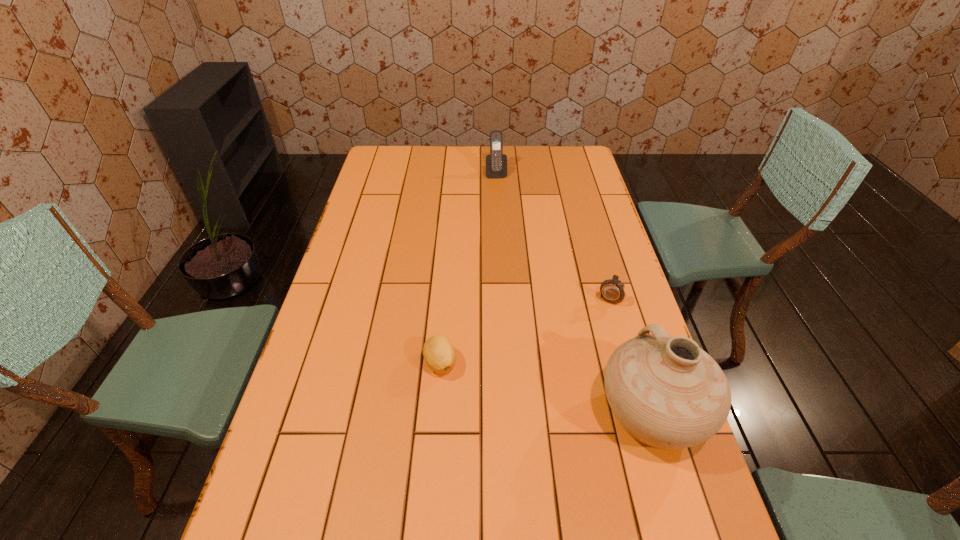
You are a GUI agent. You are given a task and a screenshot of the screen. Output one action in this format:
    pyautogui.click(x=<x>, y=<y>)
    Task: Click on the leftmost object
    The image size is (960, 540).
    Given the screenshot: What is the action you would take?
    pyautogui.click(x=439, y=353)

Where is `the shortest object`? the shortest object is located at coordinates (439, 353).

Find the location of `pottery`. pottery is located at coordinates (667, 392).

You are a GUI agent. You are given a task and a screenshot of the screen. Output one action in this format:
    pyautogui.click(x=<x>, y=<y>)
    Task: Click on the second shortest object
    Image resolution: width=960 pixels, height=540 pixels.
    Given the screenshot: What is the action you would take?
    pyautogui.click(x=612, y=291)

Image resolution: width=960 pixels, height=540 pixels. What are the coordinates of `the second farthest object` in the screenshot? It's located at (612, 291).

Find the location of a particular element. Image resolution: width=960 pixels, height=540 pixels. the third object from right to left is located at coordinates (496, 163).

I want to click on the farthest object, so click(x=496, y=163).

The height and width of the screenshot is (540, 960). What are the coordinates of `free space located at the stem end of the shortest object` in the screenshot? It's located at (429, 509).

Locate an element on the screen. free space located 0.070m on the front of the pottery is located at coordinates (679, 503).

You are a GUI agent. You are given a task and a screenshot of the screen. Output one action in this format:
    pyautogui.click(x=<x>, y=<y>)
    Task: Click on the vacant space located 0.290m on the face of the third nearest object
    
    Given the screenshot: What is the action you would take?
    pyautogui.click(x=565, y=378)